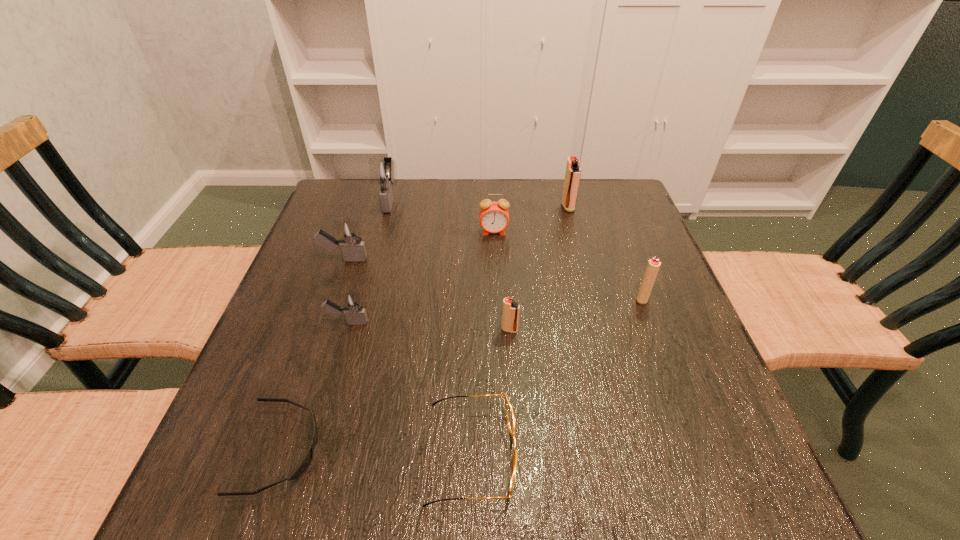
The image size is (960, 540). What are the coordinates of `free region located on the front of the fourth igniter from left to right` in the screenshot? It's located at pyautogui.click(x=519, y=483).

This screenshot has width=960, height=540. In order to click on vacant area situated 0.230m on the right of the nearest gray igniter in this screenshot , I will do `click(477, 322)`.

Find the location of a particular element. The height and width of the screenshot is (540, 960). vacant region located 0.270m on the front-facing side of the gold spectacles is located at coordinates (680, 453).

This screenshot has width=960, height=540. I want to click on blank space located 0.150m on the front-facing side of the sunglasses, so click(x=407, y=449).

What are the coordinates of `spectacles located in the near edge section of the desktop` in the screenshot? It's located at (510, 417).

The height and width of the screenshot is (540, 960). What are the coordinates of `sunglasses that is at the near edge` in the screenshot? It's located at (308, 457).

This screenshot has height=540, width=960. Find the location of `sunglasses that is at the left edge`. sunglasses that is at the left edge is located at coordinates (308, 457).

Where is `object that is at the right edge`? The height and width of the screenshot is (540, 960). object that is at the right edge is located at coordinates (653, 266).

This screenshot has height=540, width=960. What are the coordinates of `object located in the far left corner section of the desktop` in the screenshot? It's located at (382, 171).

In order to click on object located in the near left corner section of the desktop in this screenshot , I will do `click(308, 457)`.